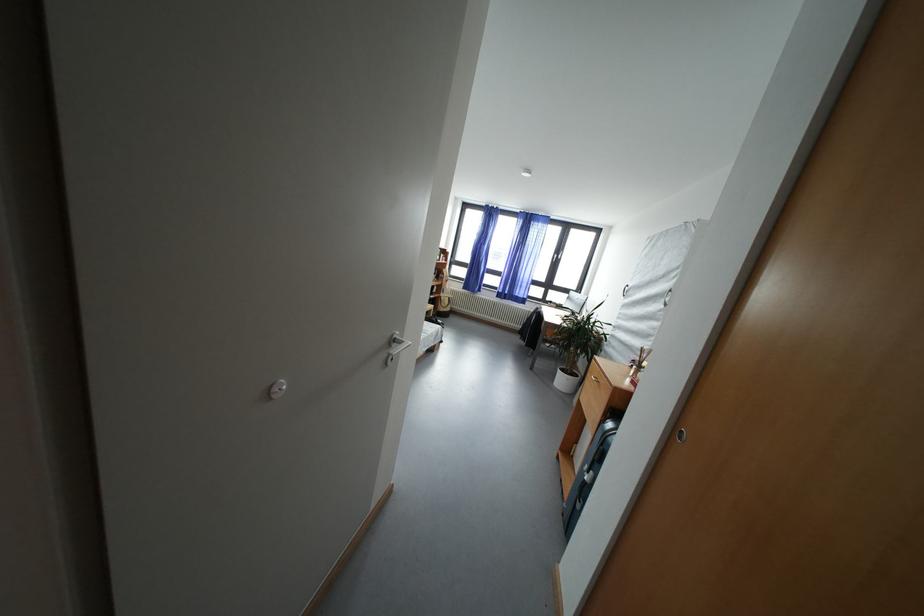
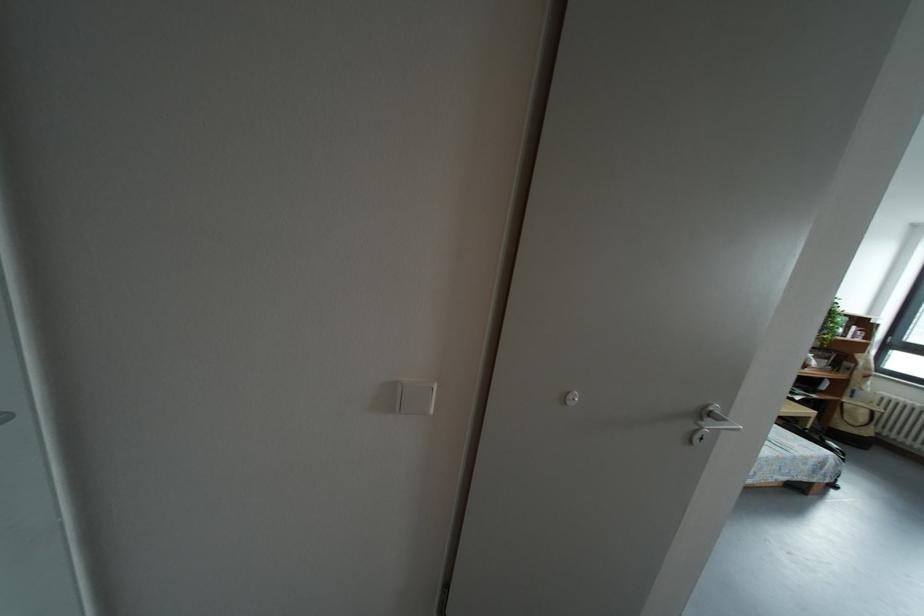
Question: The images are taken continuously from a first-person perspective. In which direction is your viewpoint rotating?

Choices:
 (A) Left
 (B) Right
 (C) Up
 (D) Down

Answer: (A)